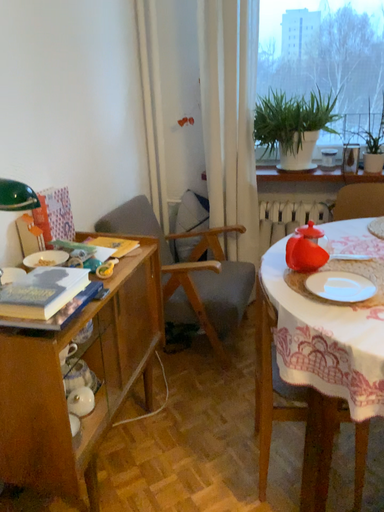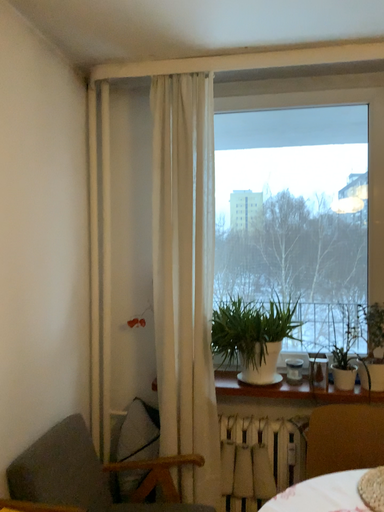
Question: Which way did the camera rotate in the video?

Choices:
 (A) rotated downward
 (B) rotated upward

Answer: (B)